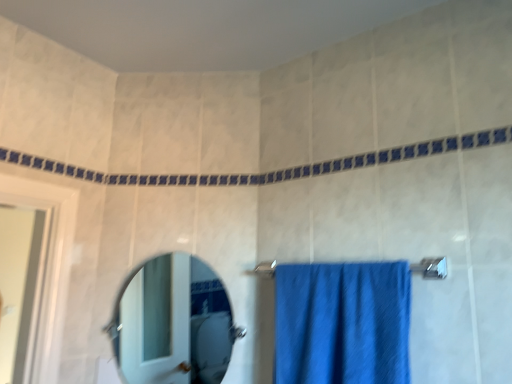
Question: Considering the relative sizes of polished silver mirror at center and blue fabric towel at center in the image provided, is polished silver mirror at center bigger than blue fabric towel at center?

Choices:
 (A) no
 (B) yes

Answer: (A)

Question: From the image's perspective, would you say polished silver mirror at center is positioned over blue fabric towel at center?

Choices:
 (A) yes
 (B) no

Answer: (B)

Question: From a real-world perspective, is polished silver mirror at center physically below blue fabric towel at center?

Choices:
 (A) yes
 (B) no

Answer: (B)

Question: Is polished silver mirror at center wider than blue fabric towel at center?

Choices:
 (A) yes
 (B) no

Answer: (B)

Question: Is the position of polished silver mirror at center less distant than that of blue fabric towel at center?

Choices:
 (A) no
 (B) yes

Answer: (A)

Question: Does point (428, 266) appear closer or farther from the camera than point (292, 297)?

Choices:
 (A) closer
 (B) farther

Answer: (A)

Question: In terms of height, does blue fabric towel bar at center look taller or shorter compared to blue fabric towel at center?

Choices:
 (A) tall
 (B) short

Answer: (B)

Question: From the image's perspective, is blue fabric towel bar at center above or below blue fabric towel at center?

Choices:
 (A) above
 (B) below

Answer: (A)

Question: From a real-world perspective, is blue fabric towel bar at center above or below blue fabric towel at center?

Choices:
 (A) above
 (B) below

Answer: (A)

Question: In terms of size, does polished silver mirror at center appear bigger or smaller than blue fabric towel bar at center?

Choices:
 (A) small
 (B) big

Answer: (B)

Question: Is point click(223, 329) closer or farther from the camera than point click(411, 266)?

Choices:
 (A) farther
 (B) closer

Answer: (A)

Question: Would you say polished silver mirror at center is to the left or to the right of blue fabric towel bar at center in the picture?

Choices:
 (A) left
 (B) right

Answer: (A)

Question: Is polished silver mirror at center inside or outside of blue fabric towel bar at center?

Choices:
 (A) inside
 (B) outside

Answer: (B)

Question: Based on their sizes in the image, would you say blue fabric towel bar at center is bigger or smaller than polished silver mirror at center?

Choices:
 (A) small
 (B) big

Answer: (A)

Question: In terms of width, does blue fabric towel bar at center look wider or thinner when compared to polished silver mirror at center?

Choices:
 (A) thin
 (B) wide

Answer: (B)